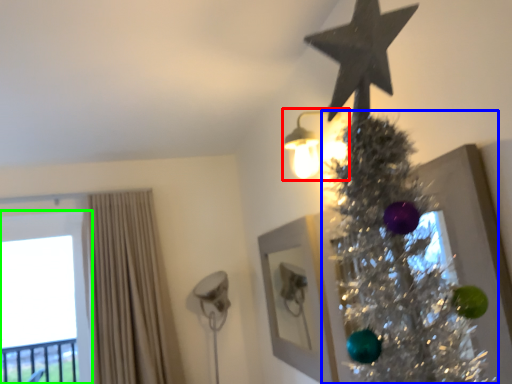
Question: Which is farther away from light fixture (highlighted by a red box)? christmas tree (highlighted by a blue box) or window (highlighted by a green box)?

Choices:
 (A) christmas tree
 (B) window

Answer: (B)